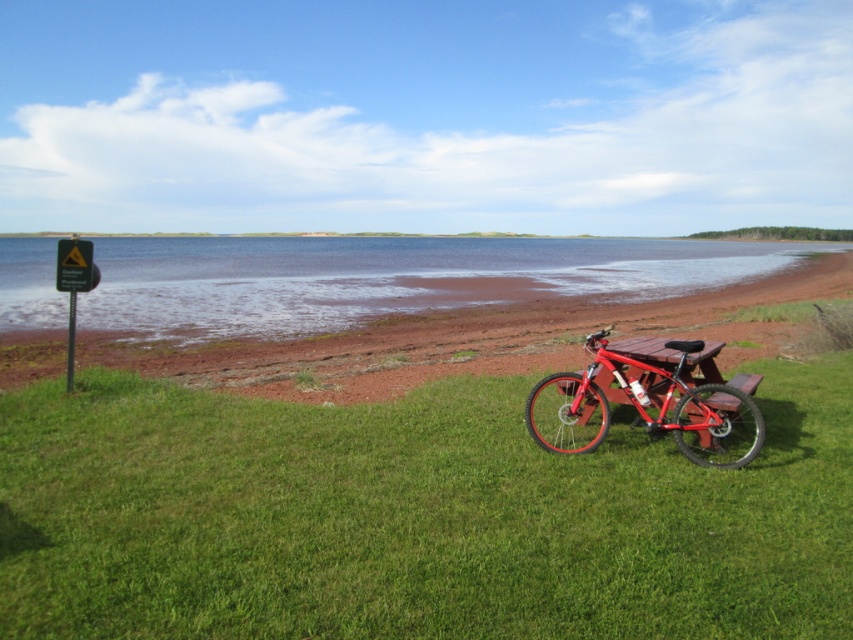
Does green grassy at lower center have a lesser width compared to clear blue water at center?

Yes, green grassy at lower center is thinner than clear blue water at center.

Who is lower down, green grassy at lower center or clear blue water at center?

Positioned lower is green grassy at lower center.

Is point (828, 566) closer to viewer compared to point (189, 332)?

Yes, point (828, 566) is in front of point (189, 332).

Locate an element on the screen. The image size is (853, 640). green grassy at lower center is located at coordinates (413, 516).

Who is higher up, green grassy at lower center or shiny red mountain bike at center?

Positioned higher is shiny red mountain bike at center.

Who is positioned more to the left, green grassy at lower center or shiny red mountain bike at center?

Positioned to the left is green grassy at lower center.

Where is `green grassy at lower center`? The width and height of the screenshot is (853, 640). green grassy at lower center is located at coordinates (413, 516).

The image size is (853, 640). What are the coordinates of `green grassy at lower center` in the screenshot? It's located at (413, 516).

Is the position of clear blue water at center more distant than that of shiny red mountain bike at center?

Yes, clear blue water at center is behind shiny red mountain bike at center.

Which is more to the right, clear blue water at center or shiny red mountain bike at center?

shiny red mountain bike at center

Is point (407, 244) in front of point (689, 413)?

That is False.

Find the location of a particular element. This screenshot has width=853, height=640. clear blue water at center is located at coordinates (387, 276).